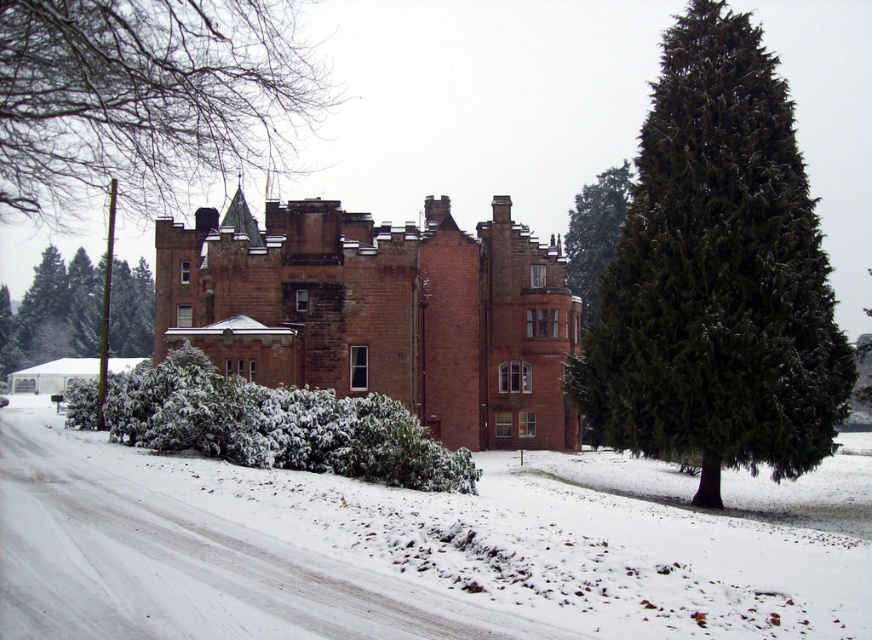
Question: Which is nearer to the white fluffy snow at center?

Choices:
 (A) green textured evergreen tree at right
 (B) snow-covered bush at lower left

Answer: (B)

Question: Which object is the farthest from the green textured tree at upper center?

Choices:
 (A) green textured bush at left
 (B) green needle-like at right

Answer: (A)

Question: Can you confirm if green needle-like at right is positioned to the right of snow-covered bush at lower left?

Choices:
 (A) no
 (B) yes

Answer: (B)

Question: Is green needle-like at right smaller than brick castle at center?

Choices:
 (A) no
 (B) yes

Answer: (B)

Question: Which of these objects is positioned farthest from the brick castle at center?

Choices:
 (A) green textured bush at left
 (B) white fluffy snow at center
 (C) snow-covered bush at lower left

Answer: (A)

Question: Is white fluffy snow at center positioned in front of brick castle at center?

Choices:
 (A) no
 (B) yes

Answer: (B)